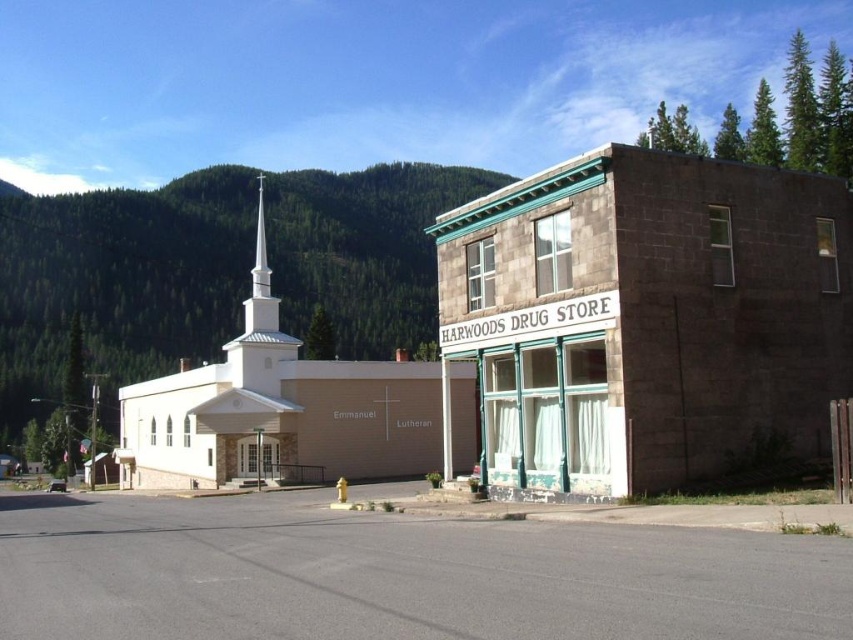
You are a town planner assessing the layout of the buildings. Given the space they occupy, which building would you recommend expanding first to accommodate more space for events? Please consider the current size of both the matte stone church at center and the white smooth steeple at center.

The matte stone church at center occupies less space than the white smooth steeple at center, so it would be more feasible to expand the matte stone church at center first since it has more potential for growth without significantly disrupting the existing structure.